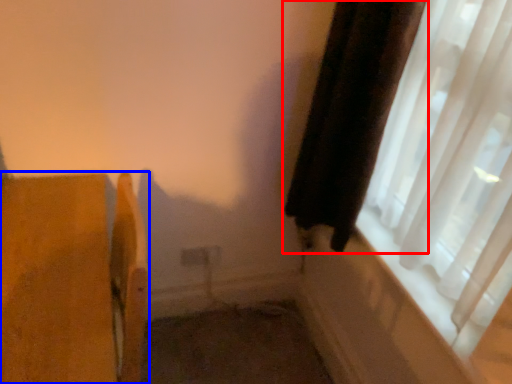
Question: Which object appears farthest to the camera in this image, curtain (highlighted by a red box) or furniture (highlighted by a blue box)?

Choices:
 (A) curtain
 (B) furniture

Answer: (A)